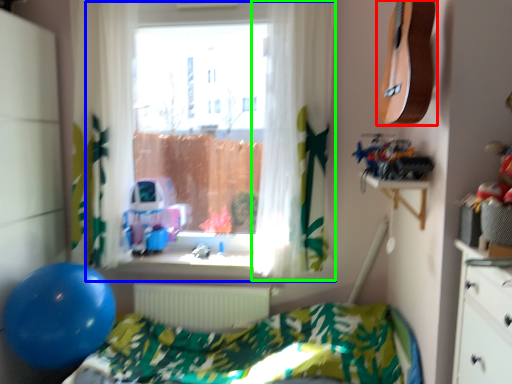
Question: Considering the real-world distances, which object is closest to guitar (highlighted by a red box)? window (highlighted by a blue box) or curtain (highlighted by a green box).

Choices:
 (A) window
 (B) curtain

Answer: (B)